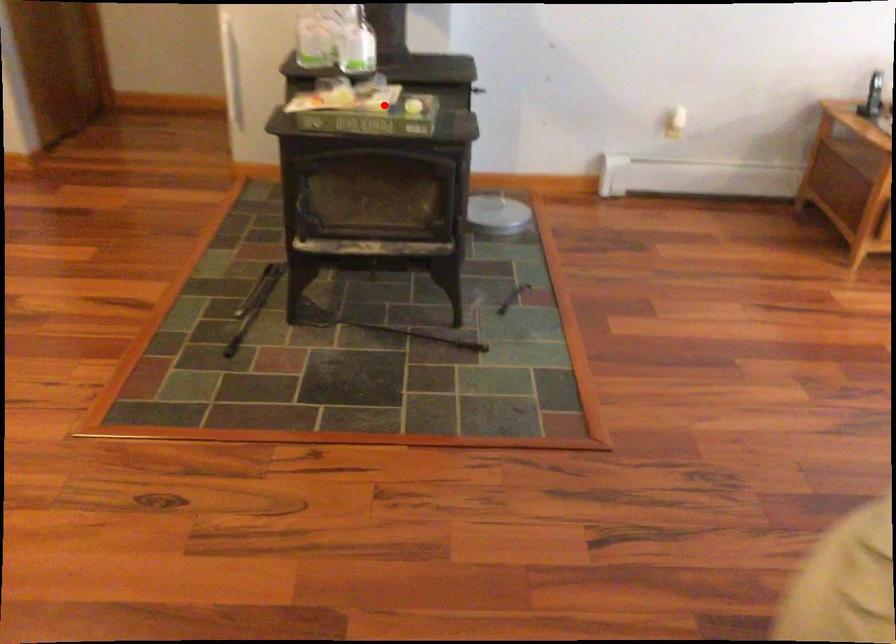
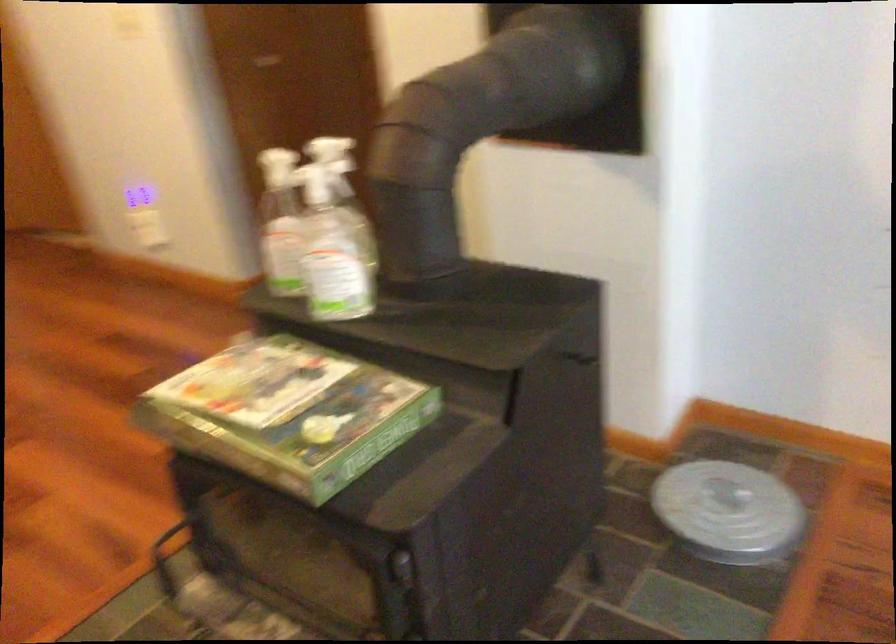
Question: I am providing you with two images of the same scene from different viewpoints. Given a red point in image1, look at the same physical point in image2. Is it:

Choices:
 (A) Closer to the viewpoint
 (B) Farther from the viewpoint

Answer: (A)